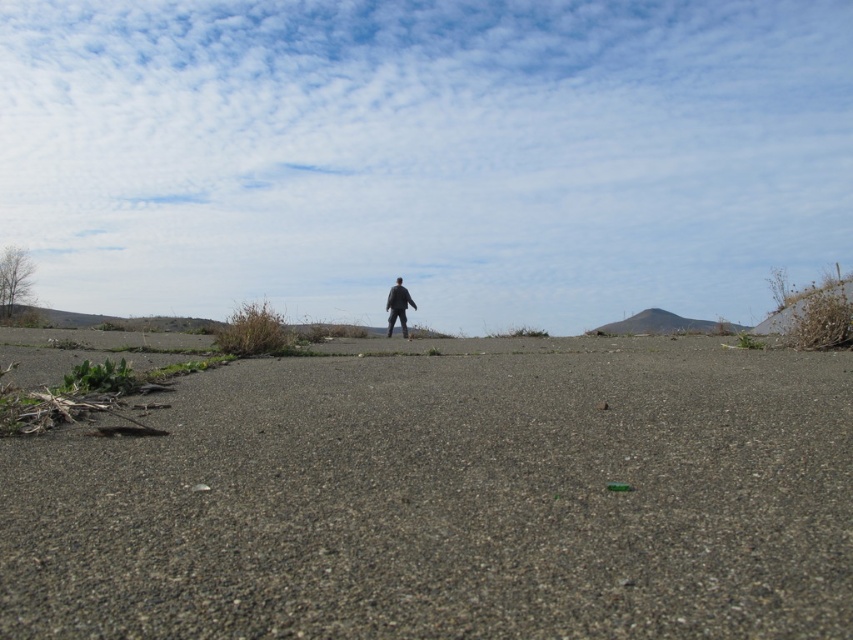
Can you confirm if gray gravelly dirt at center is positioned to the left of black matte jacket at center?

No, gray gravelly dirt at center is not to the left of black matte jacket at center.

Is gray gravelly dirt at center wider than black matte jacket at center?

Yes.

You are a GUI agent. You are given a task and a screenshot of the screen. Output one action in this format:
    pyautogui.click(x=<x>, y=<y>)
    Task: Click on the gray gravelly dirt at center
    The height and width of the screenshot is (640, 853).
    Given the screenshot: What is the action you would take?
    point(450,499)